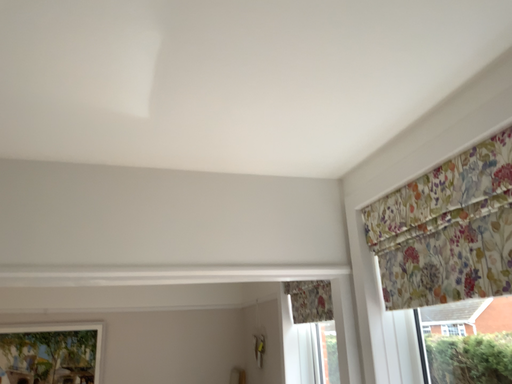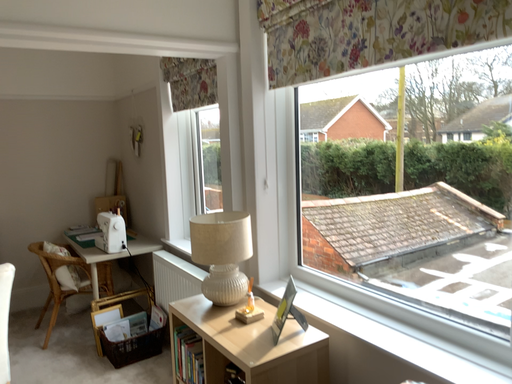
Question: Which way did the camera rotate in the video?

Choices:
 (A) rotated upward
 (B) rotated downward

Answer: (B)